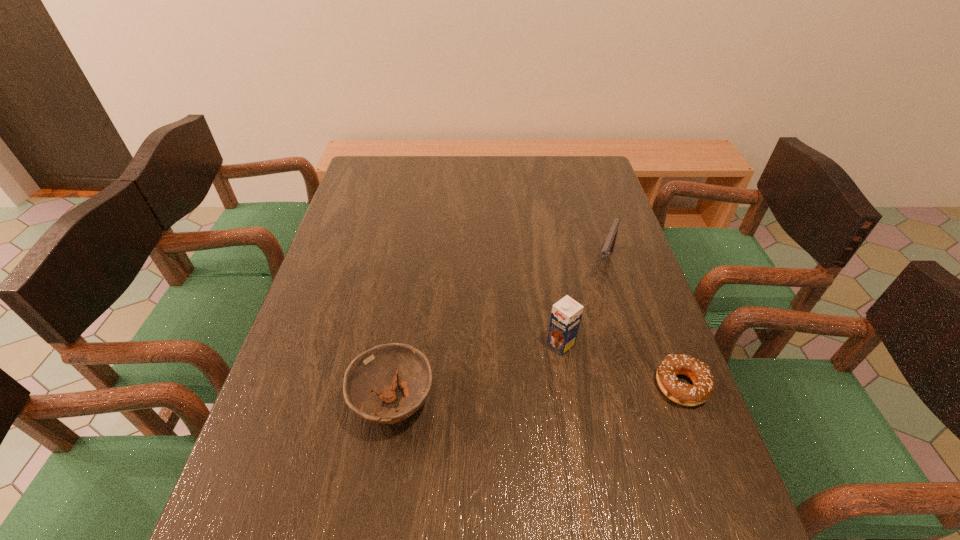
I want to click on free space on the desktop that is between the bowl and the doughnut and is positioned at the barrel of the farthest object, so click(x=553, y=393).

Find the location of a particular element. Image resolution: width=960 pixels, height=540 pixels. vacant space on the desktop that is between the bowl and the shortest object and is positioned on the front label of the second farthest object is located at coordinates (496, 396).